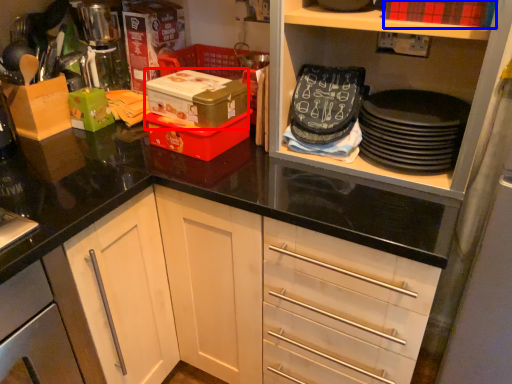
Question: Among these objects, which one is nearest to the camera, box (highlighted by a red box) or box (highlighted by a blue box)?

Choices:
 (A) box
 (B) box

Answer: (B)